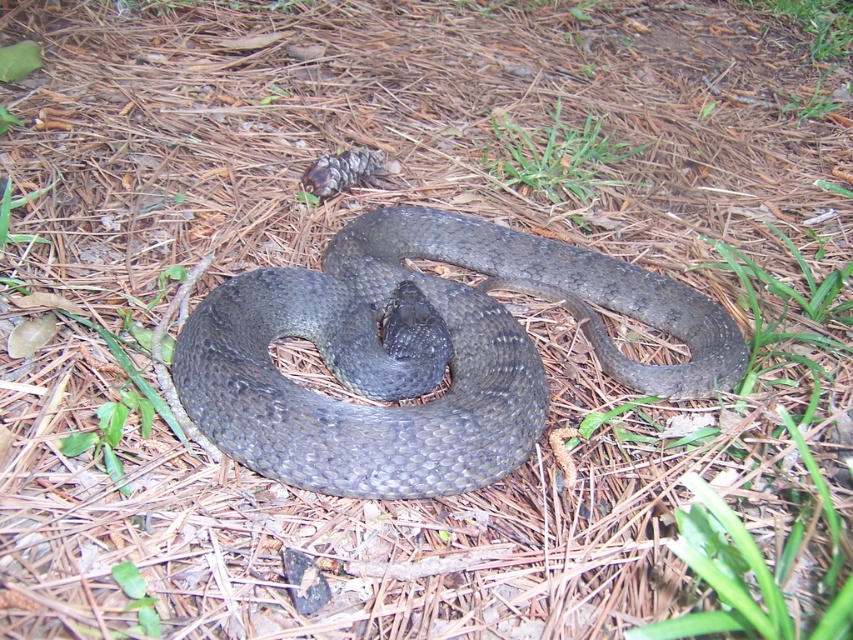
You are a hiker in the forest and spot the shiny dark gray snake at center and the green soft grass at upper center. Which object is positioned to the left of the other?

The shiny dark gray snake at center is to the left of green soft grass at upper center.

Looking at this image, you are a hiker who has spotted the shiny dark gray snake at center in a forest. Based on its position coordinates, can you determine if the snake is closer to the center of the forest clearing or the edge?

The shiny dark gray snake at center is located at coordinates point (419, 355), which places it near the center of the forest clearing.

You are a gardener who wants to place a 3.5 feet long garden hose between the shiny dark gray snake at center and the green soft grass at upper center. Can you fit the hose between them without bending it?

The distance between the shiny dark gray snake at center and the green soft grass at upper center is 3.57 feet, which is slightly longer than the 3.5 feet garden hose. Therefore, the hose can fit between them without bending.